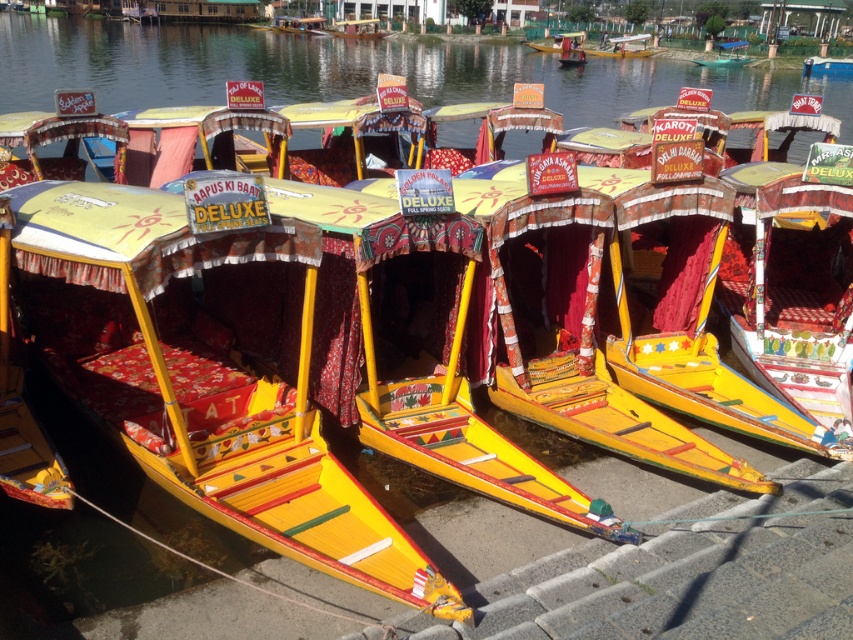
Question: Can you confirm if yellow painted wood boat at center is smaller than matte yellow boat at center?

Choices:
 (A) yes
 (B) no

Answer: (A)

Question: Which object is closer to the camera taking this photo?

Choices:
 (A) matte yellow boat at center
 (B) yellow painted wood boat at center

Answer: (B)

Question: Is yellow painted wood boat at center thinner than matte yellow boat at center?

Choices:
 (A) yes
 (B) no

Answer: (B)

Question: Which point is farther from the camera taking this photo?

Choices:
 (A) (155, 211)
 (B) (578, 38)

Answer: (B)

Question: Does yellow painted wood boat at center appear over matte yellow boat at center?

Choices:
 (A) yes
 (B) no

Answer: (B)